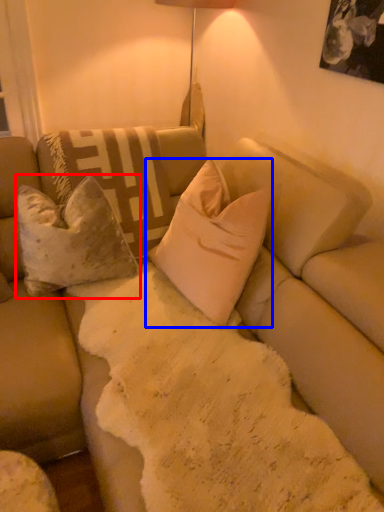
Question: Among these objects, which one is farthest to the camera, pillow (highlighted by a red box) or pillow (highlighted by a blue box)?

Choices:
 (A) pillow
 (B) pillow

Answer: (A)